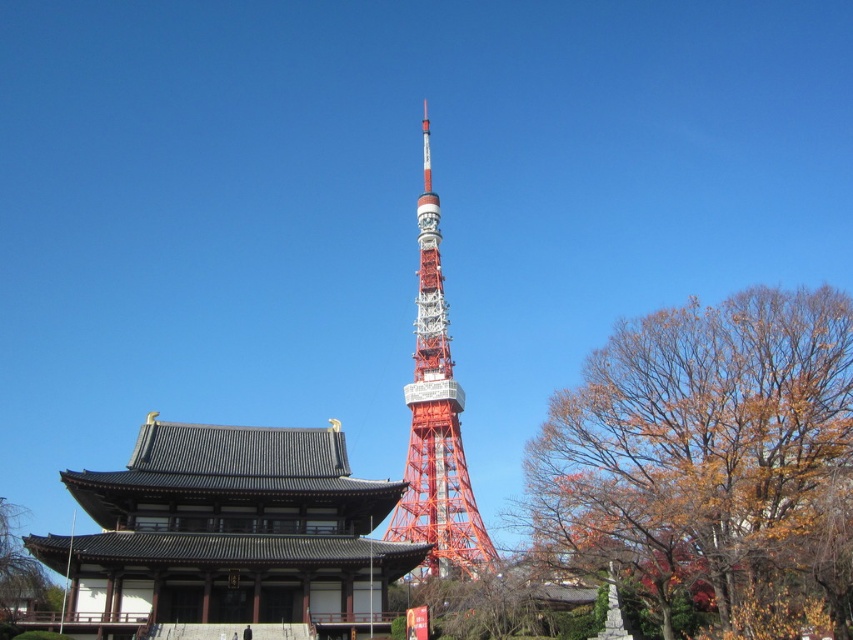
Between point (370, 586) and point (402, 500), which one is positioned behind?

Point (402, 500)

Is shiny black wood temple at lower left to the right of orange metallic tower at center from the viewer's perspective?

Incorrect, shiny black wood temple at lower left is not on the right side of orange metallic tower at center.

Locate an element on the screen. The image size is (853, 640). shiny black wood temple at lower left is located at coordinates (230, 531).

At what (x,y) coordinates should I click in order to perform the action: click on shiny black wood temple at lower left. Please return your answer as a coordinate pair (x, y). The height and width of the screenshot is (640, 853). Looking at the image, I should click on (230, 531).

Between autumn leaves at right and orange metallic tower at center, which one appears on the left side from the viewer's perspective?

Positioned to the left is orange metallic tower at center.

You are a GUI agent. You are given a task and a screenshot of the screen. Output one action in this format:
    pyautogui.click(x=<x>, y=<y>)
    Task: Click on the autumn leaves at right
    
    Given the screenshot: What is the action you would take?
    pyautogui.click(x=709, y=461)

Locate an element on the screen. autumn leaves at right is located at coordinates (709, 461).

Can you confirm if autumn leaves at right is thinner than shiny black wood temple at lower left?

Incorrect, autumn leaves at right's width is not less than shiny black wood temple at lower left's.

Between autumn leaves at right and shiny black wood temple at lower left, which one is positioned lower?

shiny black wood temple at lower left

Locate an element on the screen. autumn leaves at right is located at coordinates (709, 461).